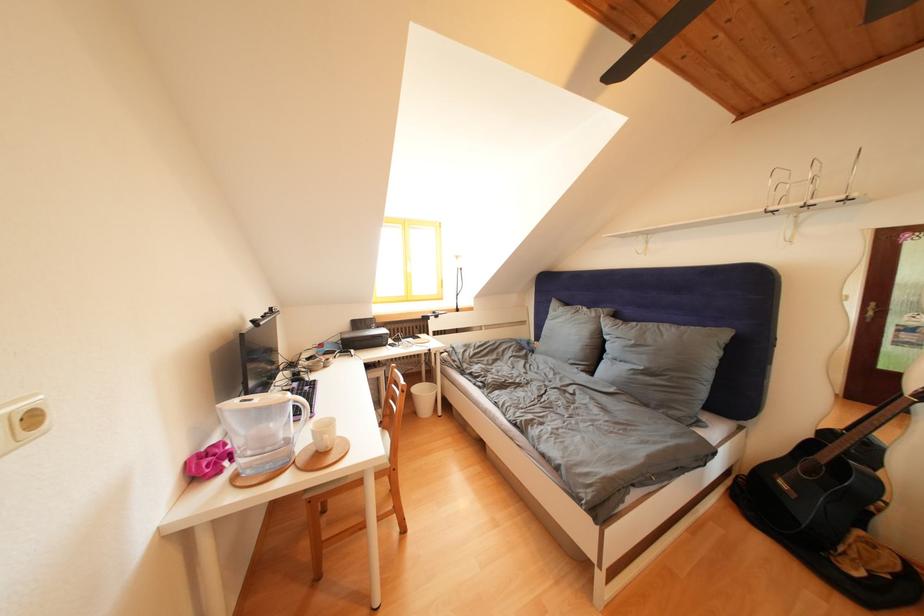
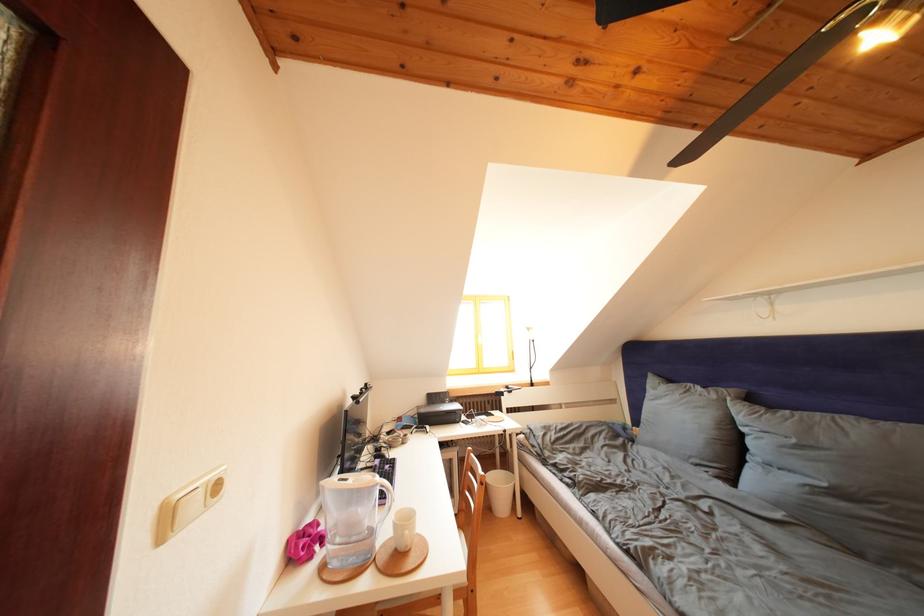
Where in the second image is the point corresponding to [297,400] from the first image?

(385, 482)